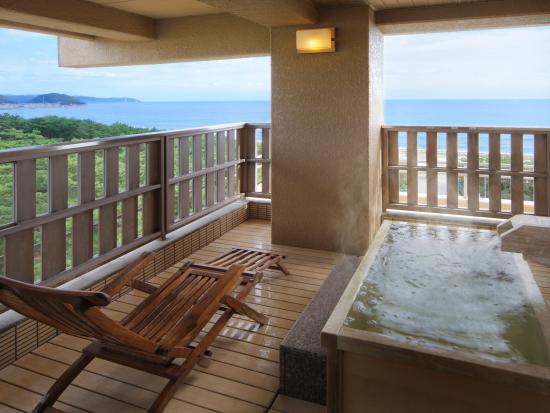
Identify the location of foot rest. (258, 259).